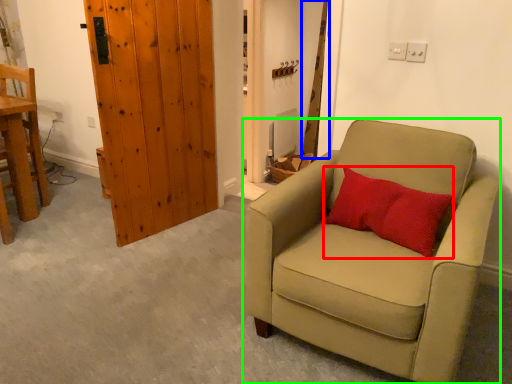
Question: Which object is the closest to the pillow (highlighted by a red box)? Choose among these: curtain (highlighted by a blue box) or chair (highlighted by a green box).

Choices:
 (A) curtain
 (B) chair

Answer: (B)